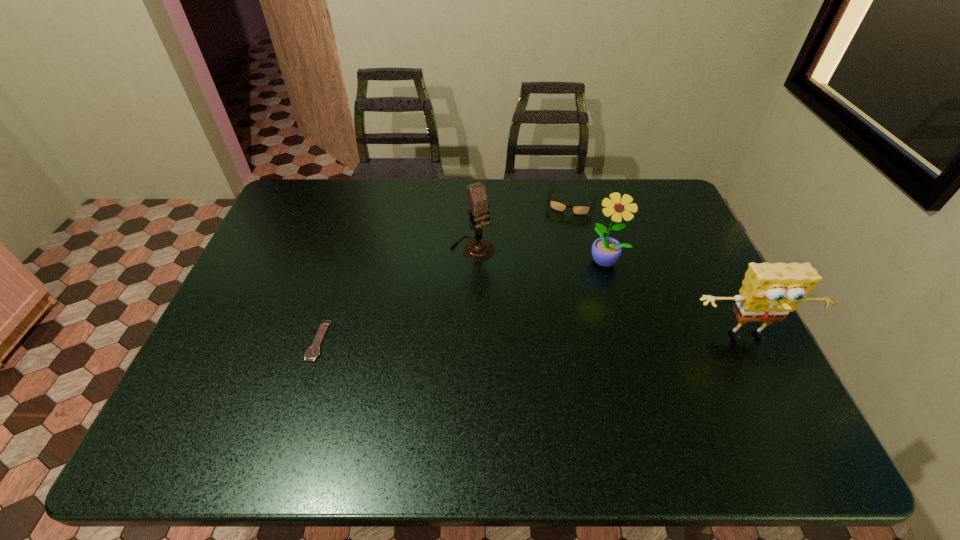
At what (x,y) coordinates should I click in order to perform the action: click on vacant space located on the front-facing side of the second object from left to right. Please return your answer as a coordinate pair (x, y). Looking at the image, I should click on (521, 307).

Where is `vacant space located on the front-facing side of the second object from left to right`? This screenshot has width=960, height=540. vacant space located on the front-facing side of the second object from left to right is located at coordinates (559, 354).

Find the location of a particular element. blank space located 0.230m on the front-facing side of the farthest object is located at coordinates (557, 263).

At what (x,y) coordinates should I click in order to perform the action: click on vacant space situated 0.400m on the front-facing side of the farthest object. Please return your answer as a coordinate pair (x, y). Looking at the image, I should click on (547, 305).

What are the coordinates of `free space located 0.390m on the front-facing side of the farthest object` in the screenshot? It's located at (548, 302).

The width and height of the screenshot is (960, 540). I want to click on free space located 0.350m on the front-facing side of the sunflower, so click(x=568, y=367).

You are a GUI agent. You are given a task and a screenshot of the screen. Output one action in this format:
    pyautogui.click(x=<x>, y=<y>)
    Task: Click on the vacant space situated 0.310m on the front-facing side of the sunflower
    The image size is (960, 540).
    Given the screenshot: What is the action you would take?
    pyautogui.click(x=573, y=354)

Find the location of a particular element. The width and height of the screenshot is (960, 540). free space located 0.290m on the front-facing side of the sunflower is located at coordinates point(575,348).

Find the location of `object that is at the far edge`. object that is at the far edge is located at coordinates (559, 206).

In order to click on object located at the right edge in this screenshot , I will do `click(769, 292)`.